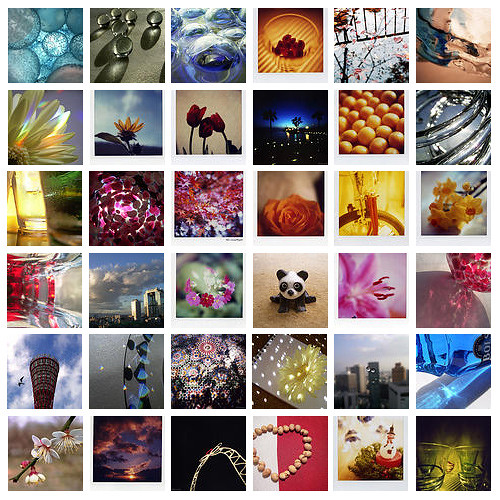
Locate an element on the screen. The height and width of the screenshot is (500, 500). boxes in second row from left is located at coordinates (140, 446), (135, 374), (134, 286), (123, 213), (108, 140), (122, 51).